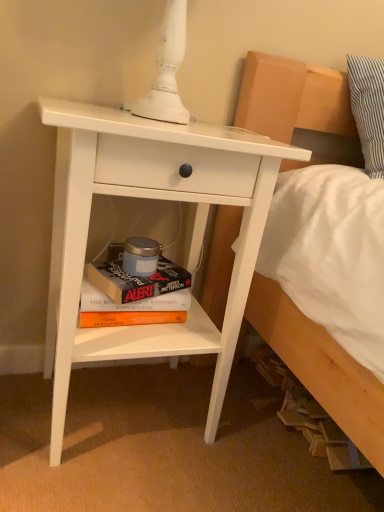
Question: Considering the relative sizes of hardcover book at lower center, which appears as the second paperback book when viewed from the top, and white matte nightstand at center-left in the image provided, is hardcover book at lower center, which appears as the second paperback book when viewed from the top, thinner than white matte nightstand at center-left?

Choices:
 (A) no
 (B) yes

Answer: (B)

Question: Can you confirm if hardcover book at lower center, which is the 1th paperback book from bottom to top, is taller than white matte nightstand at center-left?

Choices:
 (A) yes
 (B) no

Answer: (B)

Question: From the image's perspective, would you say hardcover book at lower center, which appears as the second paperback book when viewed from the top, is shown under white matte nightstand at center-left?

Choices:
 (A) no
 (B) yes

Answer: (B)

Question: Is hardcover book at lower center, which appears as the second paperback book when viewed from the top, aimed at white matte nightstand at center-left?

Choices:
 (A) no
 (B) yes

Answer: (B)

Question: Is white matte nightstand at center-left at the back of hardcover book at lower center, which is the 1th paperback book from bottom to top?

Choices:
 (A) no
 (B) yes

Answer: (B)

Question: Looking at the image, does hardcover book at lower center, which is the 1th paperback book from bottom to top, seem bigger or smaller compared to white matte nightstand at center-left?

Choices:
 (A) small
 (B) big

Answer: (A)

Question: Is hardcover book at lower center, which appears as the second paperback book when viewed from the top, taller or shorter than white matte nightstand at center-left?

Choices:
 (A) tall
 (B) short

Answer: (B)

Question: In terms of width, does hardcover book at lower center, which appears as the second paperback book when viewed from the top, look wider or thinner when compared to white matte nightstand at center-left?

Choices:
 (A) thin
 (B) wide

Answer: (A)

Question: From a real-world perspective, is hardcover book at lower center, which appears as the second paperback book when viewed from the top, above or below white matte nightstand at center-left?

Choices:
 (A) below
 (B) above

Answer: (A)

Question: In terms of width, does hardcover book at lower center, the 1th paperback book viewed from the top, look wider or thinner when compared to hardcover book at lower center, which is the 1th paperback book from bottom to top?

Choices:
 (A) wide
 (B) thin

Answer: (A)

Question: Relative to hardcover book at lower center, which appears as the second paperback book when viewed from the top, is hardcover book at lower center, the 1th paperback book viewed from the top, in front or behind?

Choices:
 (A) front
 (B) behind

Answer: (A)

Question: Is hardcover book at lower center, the 1th paperback book viewed from the top, to the left or to the right of hardcover book at lower center, which appears as the second paperback book when viewed from the top, in the image?

Choices:
 (A) left
 (B) right

Answer: (B)

Question: Choose the correct answer: Is hardcover book at lower center, acting as the second paperback book starting from the bottom, inside hardcover book at lower center, which appears as the second paperback book when viewed from the top, or outside it?

Choices:
 (A) inside
 (B) outside

Answer: (B)

Question: In the image, is white matte nightstand at center-left positioned in front of or behind hardcover book at lower center, which appears as the second paperback book when viewed from the top?

Choices:
 (A) front
 (B) behind

Answer: (A)

Question: Which is correct: white matte nightstand at center-left is inside hardcover book at lower center, which is the 1th paperback book from bottom to top, or outside of it?

Choices:
 (A) inside
 (B) outside

Answer: (B)